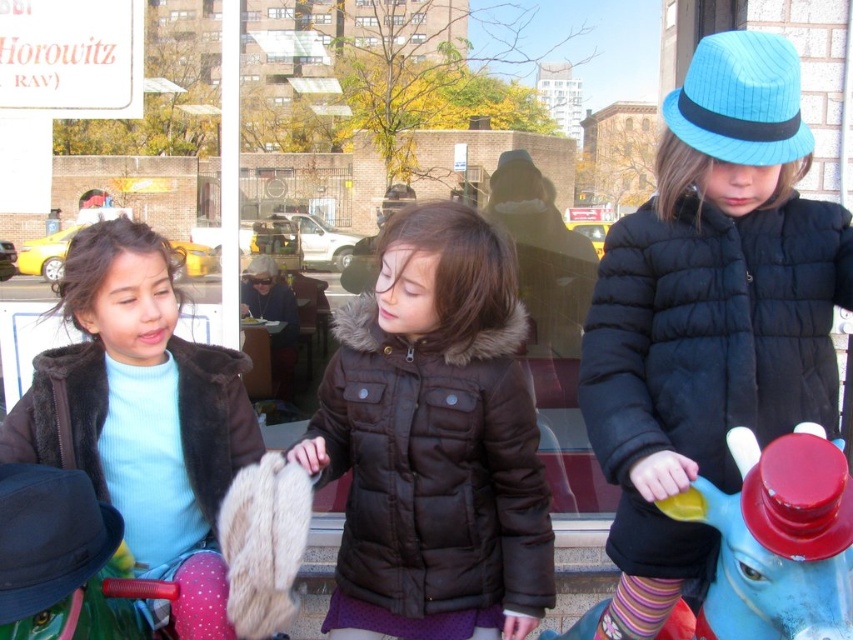
Between point (807, 328) and point (36, 364), which one is positioned in front?

Point (807, 328) is in front.

Who is more distant from viewer, (746, 348) or (7, 460)?

Point (7, 460)

Find the location of a particular element. black puffy jacket at center is located at coordinates (712, 332).

Where is `black puffy jacket at center`? black puffy jacket at center is located at coordinates (712, 332).

Consider the image. Which is below, brown quilted jacket at center or blue plastic horse at right?

blue plastic horse at right is lower down.

Is point (456, 428) more distant than point (786, 612)?

Yes, point (456, 428) is behind point (786, 612).

Image resolution: width=853 pixels, height=640 pixels. Find the location of `brown quilted jacket at center`. brown quilted jacket at center is located at coordinates (434, 468).

How much distance is there between black puffy jacket at center and blue plastic horse at right?

38.14 centimeters

Who is more distant from viewer, [780,388] or [717,524]?

Point [780,388]

Find the location of a particular element. The image size is (853, 640). black puffy jacket at center is located at coordinates (712, 332).